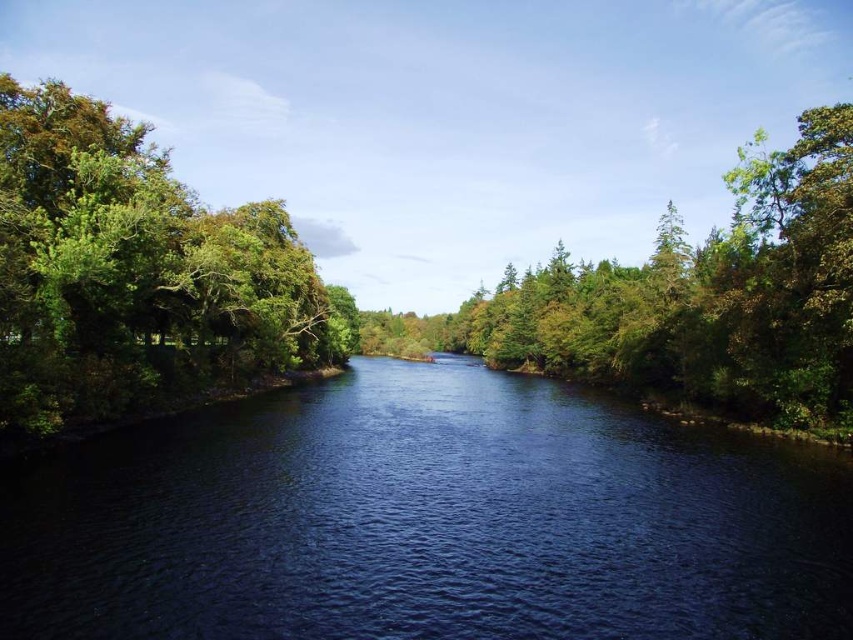
Between point (328, 589) and point (206, 371), which one is positioned in front?

Point (328, 589) is in front.

Between deep blue water at center and green leafy forest at center, which one appears on the left side from the viewer's perspective?

From the viewer's perspective, deep blue water at center appears more on the left side.

What do you see at coordinates (427, 522) in the screenshot?
I see `deep blue water at center` at bounding box center [427, 522].

Find the location of `deep blue water at center`. deep blue water at center is located at coordinates (427, 522).

Is green leafy forest at center below green leafy tree at left?

No.

Which is in front, point (830, 268) or point (50, 212)?

Point (830, 268) is in front.

Which is behind, point (109, 243) or point (61, 369)?

The point (109, 243) is behind.

Where is `green leafy forest at center`? The width and height of the screenshot is (853, 640). green leafy forest at center is located at coordinates (390, 310).

Does deep blue water at center have a lesser height compared to green leafy tree at left?

Correct, deep blue water at center is not as tall as green leafy tree at left.

Does deep blue water at center have a lesser width compared to green leafy tree at left?

Incorrect, deep blue water at center's width is not less than green leafy tree at left's.

Image resolution: width=853 pixels, height=640 pixels. I want to click on deep blue water at center, so click(x=427, y=522).

Find the location of `deep blue water at center`. deep blue water at center is located at coordinates (427, 522).